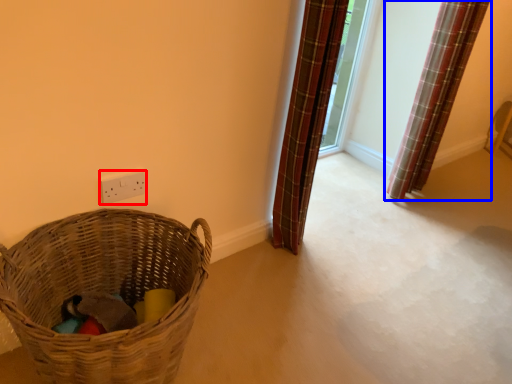
Question: Which object appears farthest to the camera in this image, electric outlet (highlighted by a red box) or curtain (highlighted by a blue box)?

Choices:
 (A) electric outlet
 (B) curtain

Answer: (B)